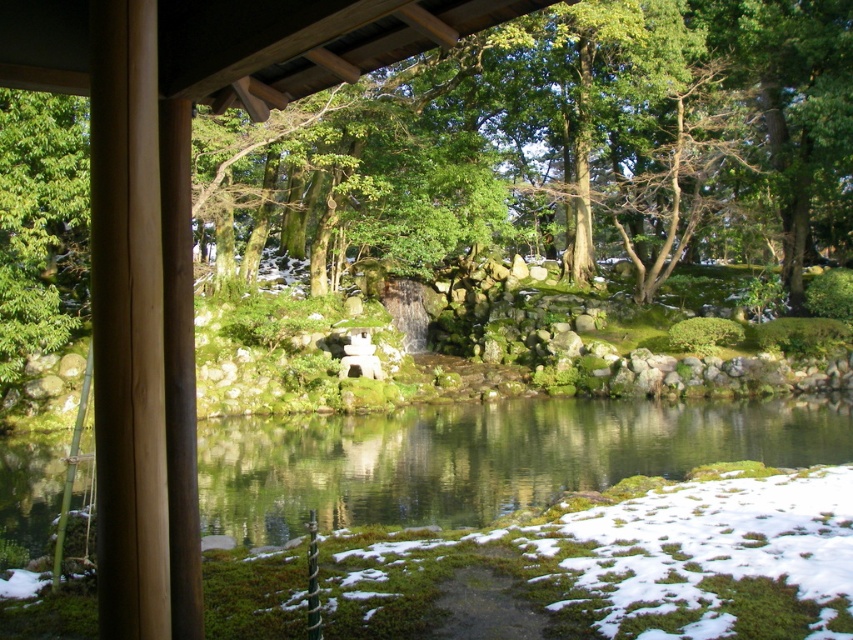
Can you confirm if green mossy water at center is thinner than green leafy tree at left?

No.

Can you confirm if green mossy water at center is taller than green leafy tree at left?

No.

Which is in front, point (415, 420) or point (13, 172)?

Point (13, 172)

In order to click on green mossy water at center in this screenshot , I will do pos(485,458).